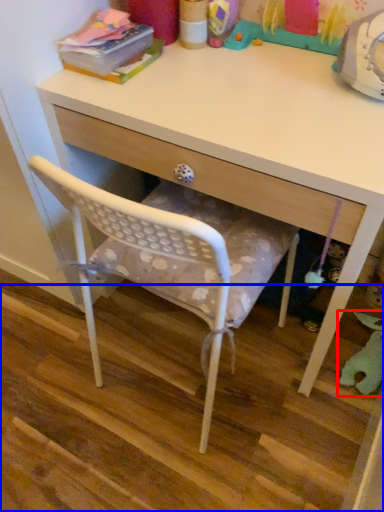
Question: Among these objects, which one is farthest to the camera, toy (highlighted by a red box) or stair (highlighted by a blue box)?

Choices:
 (A) toy
 (B) stair

Answer: (A)